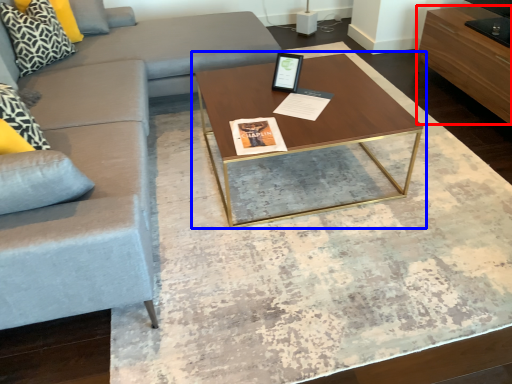
Question: Which object appears closest to the camera in this image, drawer (highlighted by a red box) or coffee table (highlighted by a blue box)?

Choices:
 (A) drawer
 (B) coffee table

Answer: (B)